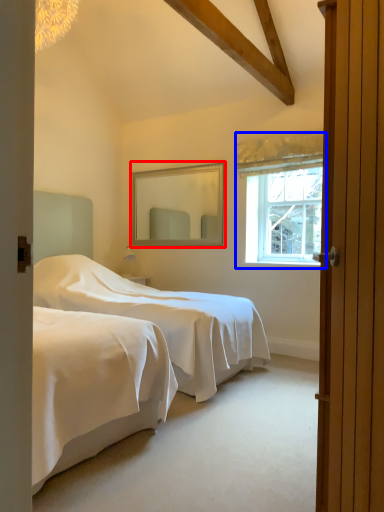
Question: Among these objects, which one is nearest to the camera, mirror (highlighted by a red box) or window (highlighted by a blue box)?

Choices:
 (A) mirror
 (B) window

Answer: (B)